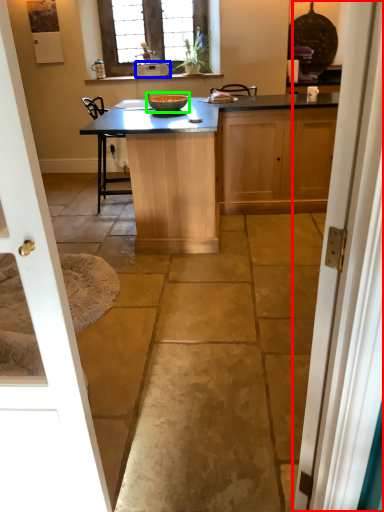
Question: Considering the real-world distances, which object is closest to door (highlighted by a red box)? appliance (highlighted by a blue box) or glass bowl (highlighted by a green box).

Choices:
 (A) appliance
 (B) glass bowl

Answer: (B)